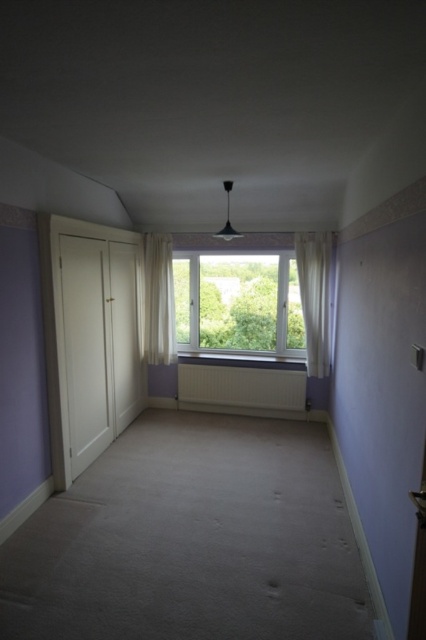
Question: Based on their relative distances, which object is nearer to the white sheer curtain at right?

Choices:
 (A) white plastic radiator at center
 (B) white sheer curtain at center

Answer: (A)

Question: Can you confirm if white plastic radiator at center is positioned above white sheer curtain at center?

Choices:
 (A) no
 (B) yes

Answer: (A)

Question: Which object appears farthest from the camera in this image?

Choices:
 (A) white sheer curtain at right
 (B) white plastic radiator at center
 (C) white plastic window at center

Answer: (C)

Question: Which point is farther to the camera?

Choices:
 (A) (166, 336)
 (B) (252, 368)
 (C) (322, 362)
 (D) (224, 346)

Answer: (D)

Question: Is white plastic window at center smaller than white sheer curtain at center?

Choices:
 (A) no
 (B) yes

Answer: (A)

Question: Does white plastic window at center have a lesser width compared to white plastic radiator at center?

Choices:
 (A) yes
 (B) no

Answer: (B)